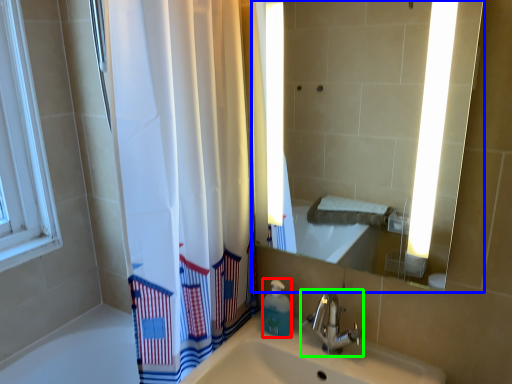
Question: Which object is the farthest from soap dispenser (highlighted by a red box)? Choose among these: mirror (highlighted by a blue box) or tap (highlighted by a green box).

Choices:
 (A) mirror
 (B) tap

Answer: (A)